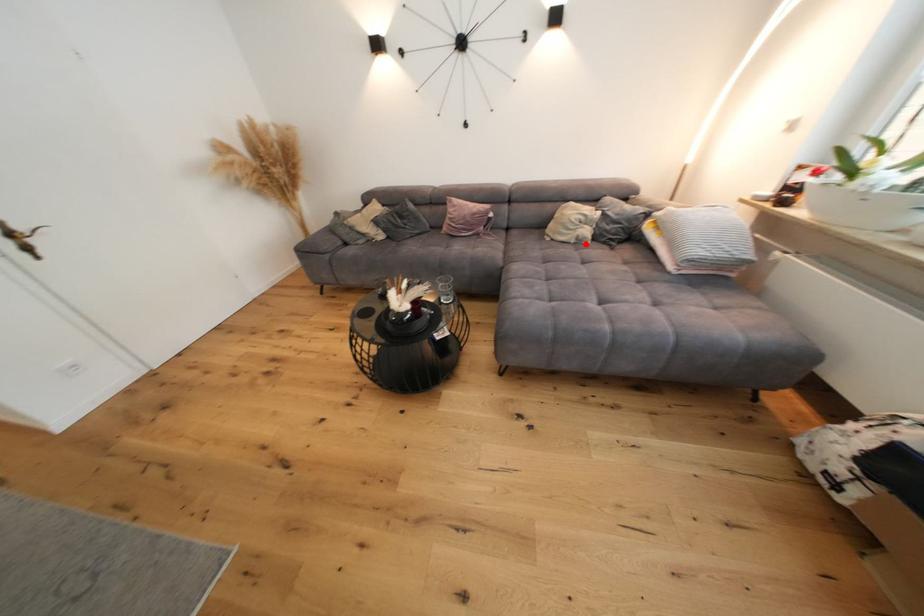
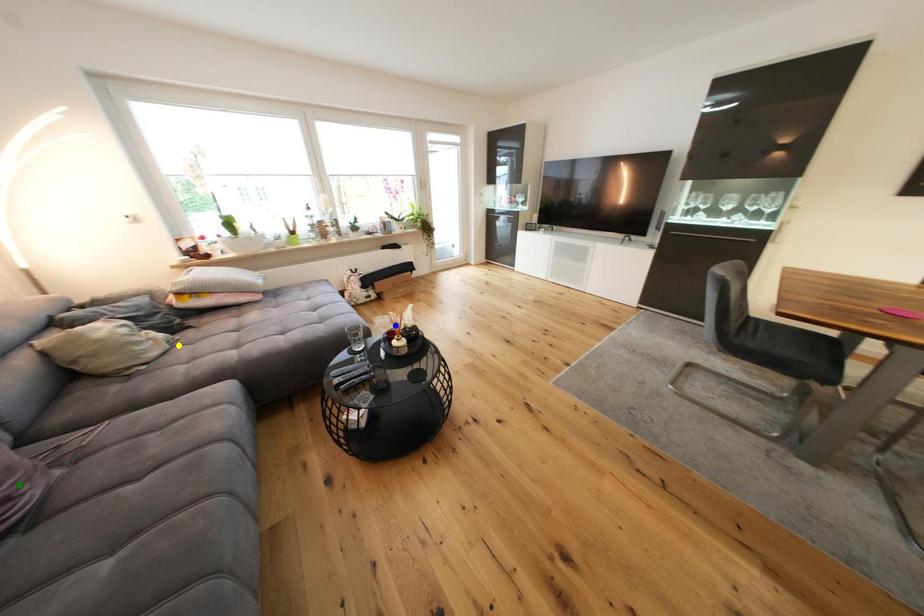
Question: I am providing you with two images of the same scene from different viewpoints. A red point is marked on the first image. You are given multiple points on the second image. Which point in image 2 is actually the same real-world point as the red point in image 1?

Choices:
 (A) blue point
 (B) yellow point
 (C) green point

Answer: (B)